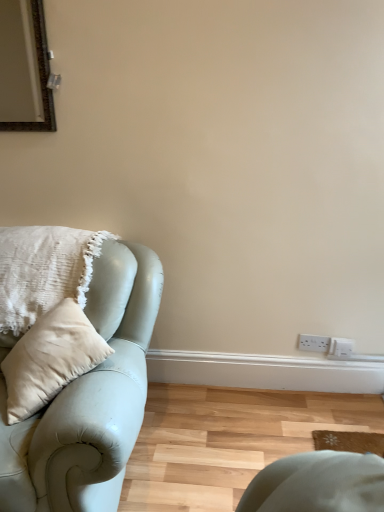
This screenshot has height=512, width=384. What do you see at coordinates (43, 272) in the screenshot?
I see `white textured cushion at left` at bounding box center [43, 272].

Identify the location of white plastic electric outlet at lower right. (314, 343).

Describe the element at coordinates (314, 343) in the screenshot. This screenshot has height=512, width=384. I see `white plastic electric outlet at lower right` at that location.

The height and width of the screenshot is (512, 384). Find the location of `sage green leather studio couch at left`. sage green leather studio couch at left is located at coordinates (89, 399).

Does white textured cushion at left contain sage green leather studio couch at left?

Actually, sage green leather studio couch at left is outside white textured cushion at left.

Which of these two, white textured cushion at left or sage green leather studio couch at left, is smaller?

white textured cushion at left is smaller.

Could you tell me if white textured cushion at left is turned towards sage green leather studio couch at left?

Yes, white textured cushion at left is aimed at sage green leather studio couch at left.

There is a sage green leather studio couch at left. In order to click on pillow above it (from a real-world perspective) in this screenshot , I will do `click(43, 272)`.

Considering the sizes of objects sage green leather studio couch at left and white textured cushion at left in the image provided, who is smaller, sage green leather studio couch at left or white textured cushion at left?

With smaller size is white textured cushion at left.

Which point is more forward, (x=5, y=485) or (x=36, y=279)?

Positioned in front is point (x=5, y=485).

Are sage green leather studio couch at left and white textured cushion at left making contact?

sage green leather studio couch at left is not next to white textured cushion at left, and they're not touching.

Measure the distance from sage green leather studio couch at left to white textured cushion at left.

They are 10.31 inches apart.

From the image's perspective, which is above, white plastic electric outlet at lower right or sage green leather studio couch at left?

sage green leather studio couch at left.

Is point (303, 346) positioned before point (98, 374)?

No.

How different are the orientations of white plastic electric outlet at lower right and sage green leather studio couch at left in degrees?

The angle between the facing direction of white plastic electric outlet at lower right and the facing direction of sage green leather studio couch at left is 0.095 degrees.

Is white plastic electric outlet at lower right positioned with its back to white textured cushion at left?

No, white plastic electric outlet at lower right's orientation is not away from white textured cushion at left.

Consider the image. Who is taller, white plastic electric outlet at lower right or white textured cushion at left?

white textured cushion at left.

From the picture: From the image's perspective, between white plastic electric outlet at lower right and white textured cushion at left, which one is located above?

From the image's view, white textured cushion at left is above.

How far apart are white plastic electric outlet at lower right and white textured cushion at left?

The distance of white plastic electric outlet at lower right from white textured cushion at left is 4.12 feet.

Is white plastic electric outlet at lower right at the back of white textured cushion at left?

No, white textured cushion at left is not facing the opposite direction of white plastic electric outlet at lower right.

How different are the orientations of white textured cushion at left and white plastic electric outlet at lower right in degrees?

They differ by 0.623 degrees in their facing directions.

From a real-world perspective, does white textured cushion at left sit lower than white plastic electric outlet at lower right?

No, from a real-world perspective, white textured cushion at left is not under white plastic electric outlet at lower right.

Is white textured cushion at left positioned behind white plastic electric outlet at lower right?

No, it is in front of white plastic electric outlet at lower right.

How different are the orientations of sage green leather studio couch at left and white plastic electric outlet at lower right in degrees?

The angle between the facing direction of sage green leather studio couch at left and the facing direction of white plastic electric outlet at lower right is 0.095 degrees.

Is sage green leather studio couch at left completely or partially outside of white plastic electric outlet at lower right?

Yes, sage green leather studio couch at left is not within white plastic electric outlet at lower right.

Is point (121, 475) less distant than point (301, 340)?

Yes, point (121, 475) is closer to viewer.

Is the position of sage green leather studio couch at left more distant than that of white plastic electric outlet at lower right?

No, it is in front of white plastic electric outlet at lower right.

In the image, there is a white textured cushion at left. What are the coordinates of `studio couch below it (from a real-world perspective)` in the screenshot? It's located at (89, 399).

Where is `studio couch in front of the white textured cushion at left`? Image resolution: width=384 pixels, height=512 pixels. studio couch in front of the white textured cushion at left is located at coordinates (89, 399).

Estimate the real-world distances between objects in this image. Which object is closer to white plastic electric outlet at lower right, sage green leather studio couch at left or white textured cushion at left?

sage green leather studio couch at left is closer to white plastic electric outlet at lower right.

From the picture: Which object lies further to the anchor point white plastic electric outlet at lower right, white textured cushion at left or sage green leather studio couch at left?

white textured cushion at left is positioned further to the anchor white plastic electric outlet at lower right.

Based on their spatial positions, is white plastic electric outlet at lower right or sage green leather studio couch at left further from white textured cushion at left?

white plastic electric outlet at lower right lies further to white textured cushion at left than the other object.

From the picture: Estimate the real-world distances between objects in this image. Which object is closer to sage green leather studio couch at left, white textured cushion at left or white plastic electric outlet at lower right?

white textured cushion at left lies closer to sage green leather studio couch at left than the other object.

When comparing their distances from white textured cushion at left, does sage green leather studio couch at left or white plastic electric outlet at lower right seem further?

Based on the image, white plastic electric outlet at lower right appears to be further to white textured cushion at left.

Considering their positions, is white plastic electric outlet at lower right positioned closer to sage green leather studio couch at left than white textured cushion at left?

The object closer to sage green leather studio couch at left is white textured cushion at left.

You are a GUI agent. You are given a task and a screenshot of the screen. Output one action in this format:
    pyautogui.click(x=<x>, y=<y>)
    Task: Click on the studio couch located between white textured cushion at left and white plastic electric outlet at lower right in the left-right direction
    This screenshot has width=384, height=512.
    Given the screenshot: What is the action you would take?
    pyautogui.click(x=89, y=399)